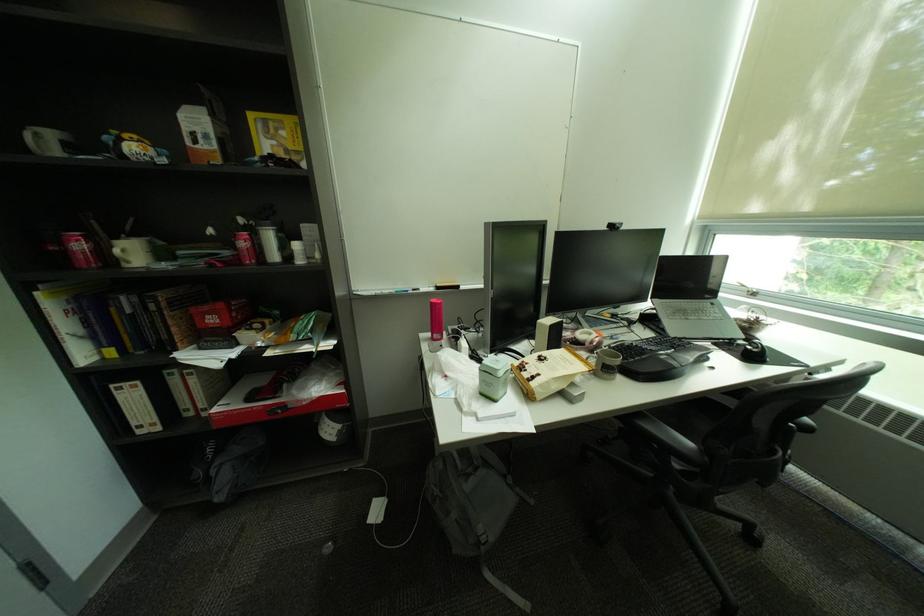
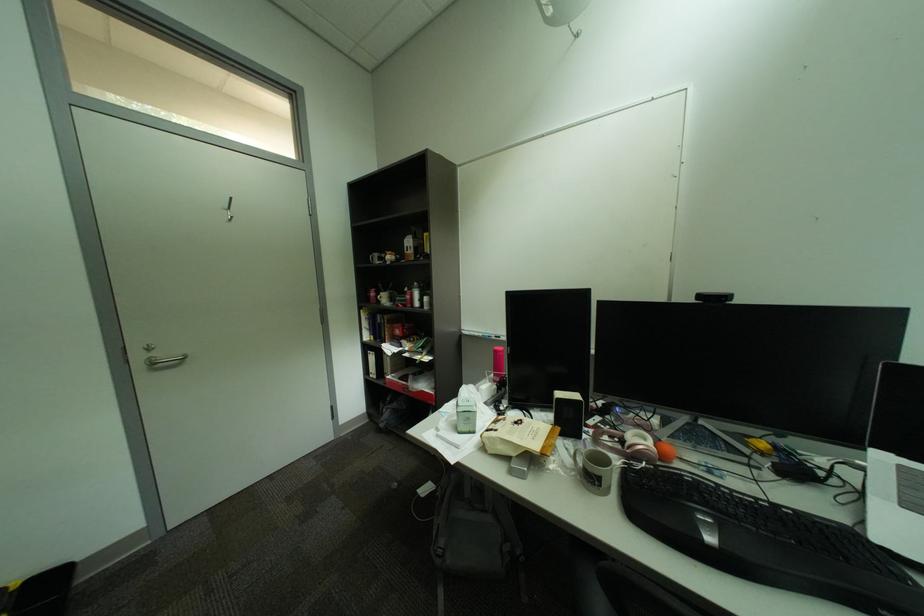
Question: The camera is either moving clockwise (left) or counter-clockwise (right) around the object. The first image is from the beginning of the video and the second image is from the end. Is the camera moving left or right when shooting the video?

Choices:
 (A) Left
 (B) Right

Answer: (B)